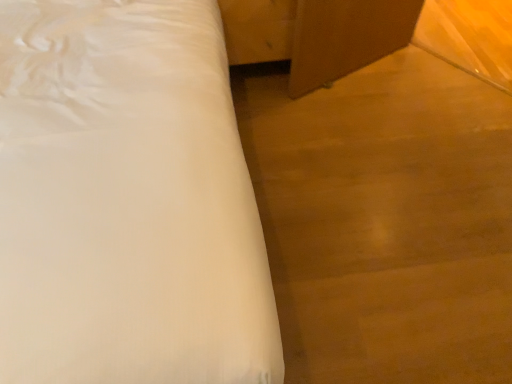
Describe the element at coordinates (127, 200) in the screenshot. Image resolution: width=512 pixels, height=384 pixels. I see `white satin bed at lower left` at that location.

Measure the distance between white satin bed at lower left and camera.

The distance of white satin bed at lower left from camera is 26.13 inches.

You are a GUI agent. You are given a task and a screenshot of the screen. Output one action in this format:
    pyautogui.click(x=<x>, y=<y>)
    Task: Click on the white satin bed at lower left
    The image size is (512, 384).
    Given the screenshot: What is the action you would take?
    pyautogui.click(x=127, y=200)

I want to click on white satin bed at lower left, so click(x=127, y=200).